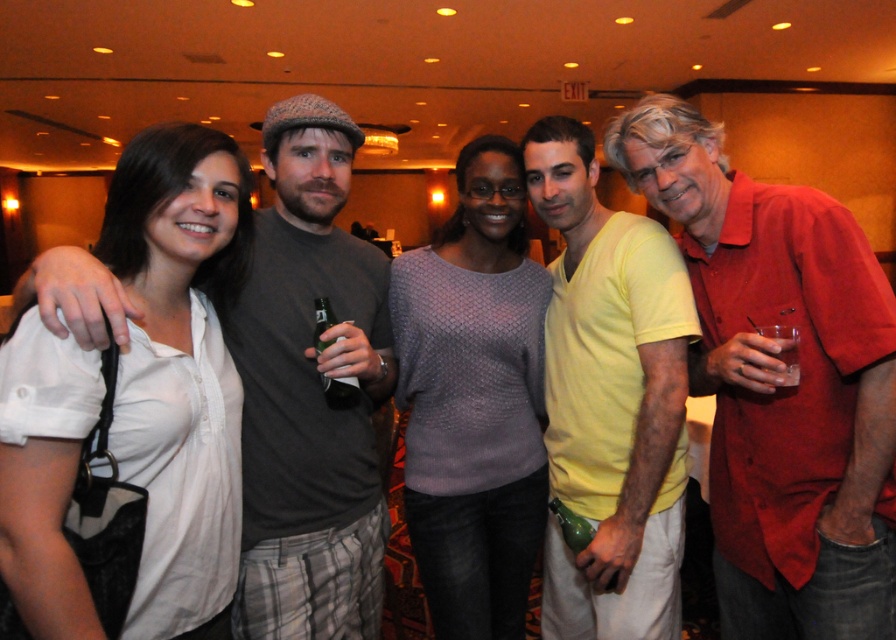
Is white matte shirt at left smaller than knitted purple sweater at center?

Correct, white matte shirt at left occupies less space than knitted purple sweater at center.

Does white matte shirt at left appear over knitted purple sweater at center?

Indeed, white matte shirt at left is positioned over knitted purple sweater at center.

In order to click on white matte shirt at left in this screenshot , I will do `click(179, 364)`.

Which is in front, point (869, 400) or point (768, 332)?

Point (869, 400) is more forward.

Is matte red shirt at right below clear plastic cup at right?

Yes.

This screenshot has height=640, width=896. Identify the location of matte red shirt at right. pyautogui.click(x=780, y=384).

This screenshot has width=896, height=640. I want to click on matte red shirt at right, so click(x=780, y=384).

Which is above, yellow matte shirt at center or knitted purple sweater at center?

Positioned higher is knitted purple sweater at center.

Is yellow matte shirt at center in front of knitted purple sweater at center?

Yes.

Is point (578, 484) closer to viewer compared to point (487, 372)?

Yes, point (578, 484) is in front of point (487, 372).

I want to click on yellow matte shirt at center, so click(x=610, y=400).